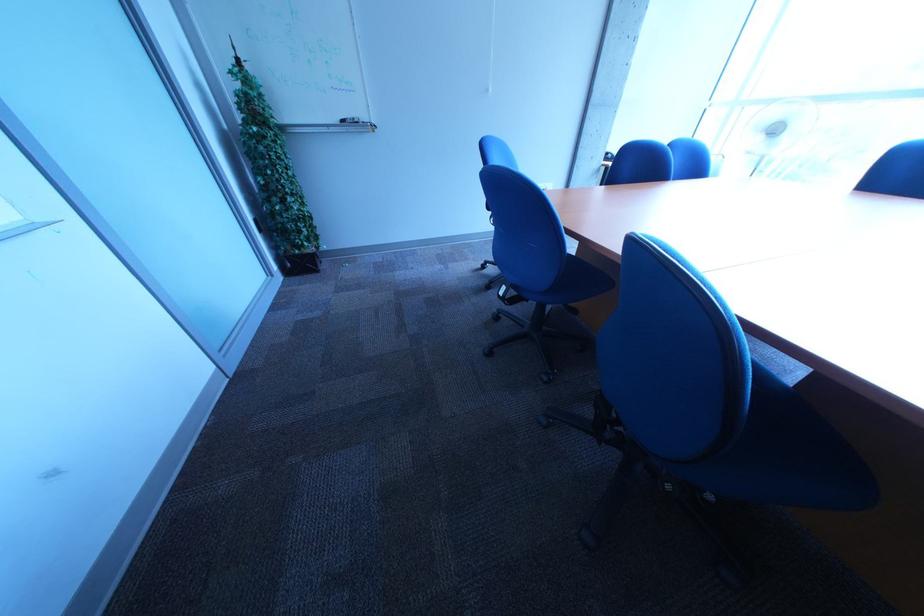
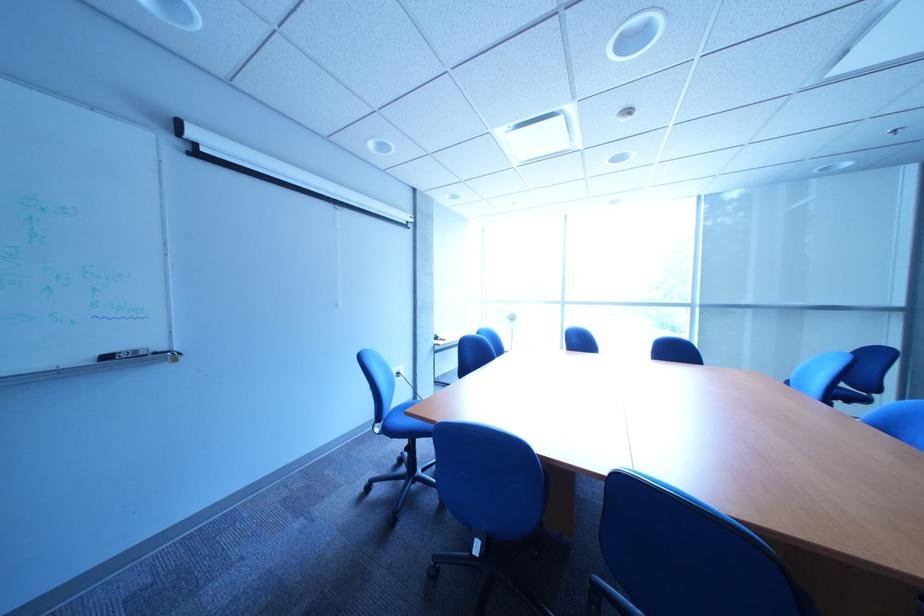
Where in the second image is the point corresponding to point 508,224 from the first image?

(392, 432)